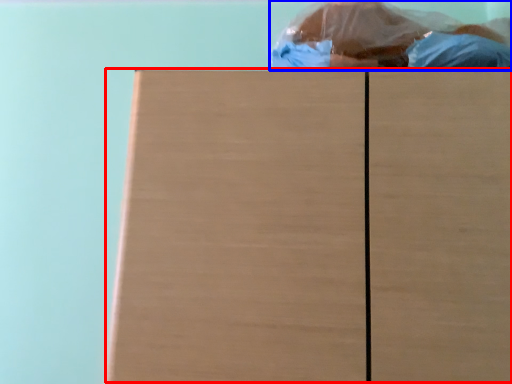
Question: Which point is closer to the camera, wood (highlighted by a red box) or person (highlighted by a blue box)?

Choices:
 (A) wood
 (B) person

Answer: (A)